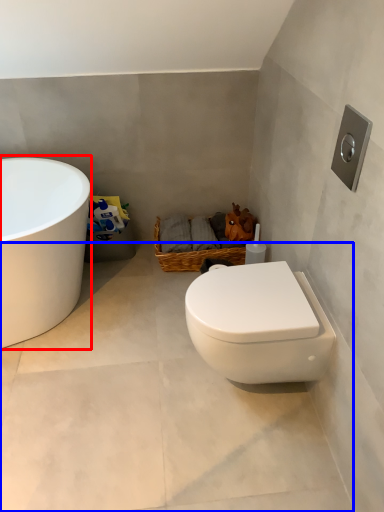
Question: Which object appears farthest to the camera in this image, bathtub (highlighted by a red box) or concrete (highlighted by a blue box)?

Choices:
 (A) bathtub
 (B) concrete

Answer: (A)